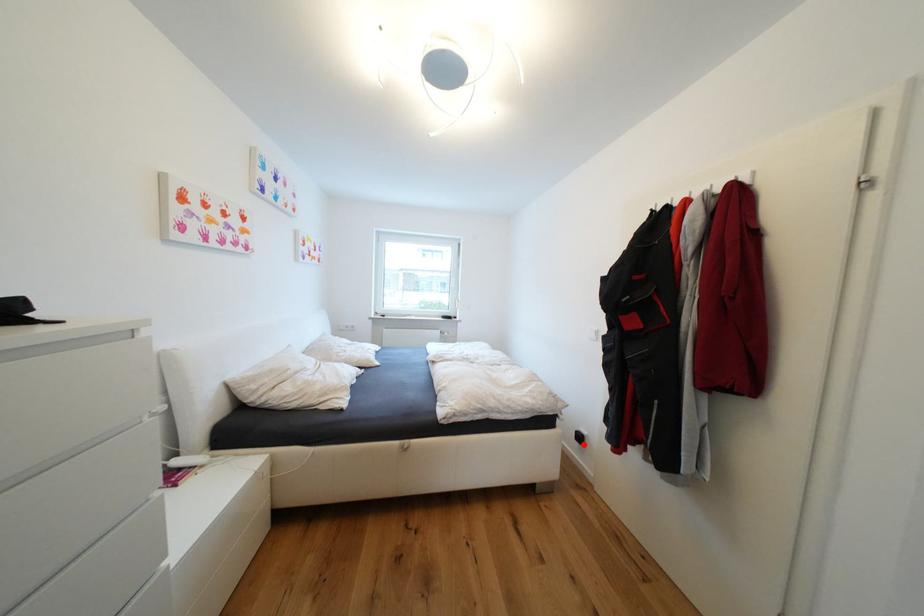
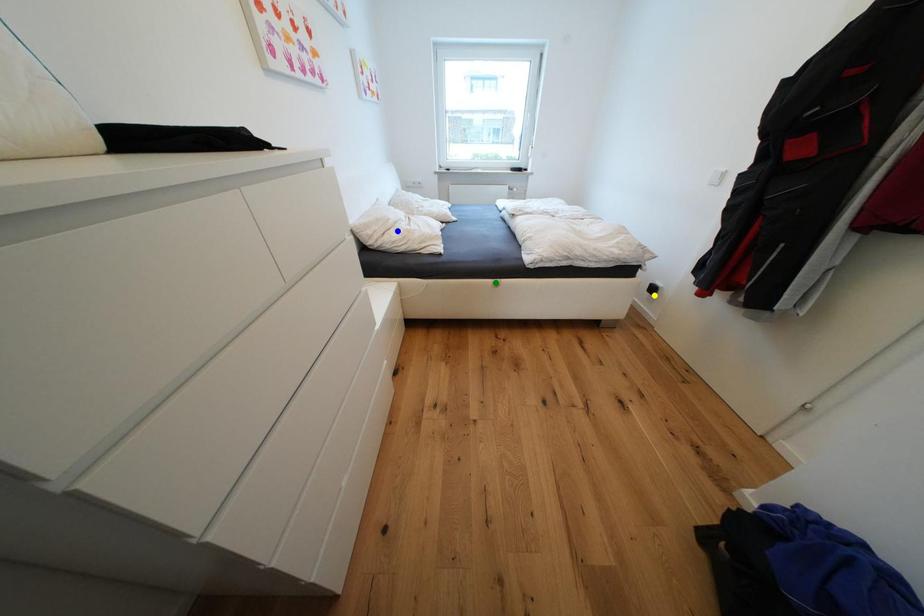
Question: I am providing you with two images of the same scene from different viewpoints. A red point is marked on the first image. You are given multiple points on the second image. In image 2, which mark is for the same physical point as the one in image 1?

Choices:
 (A) yellow point
 (B) green point
 (C) blue point

Answer: (A)